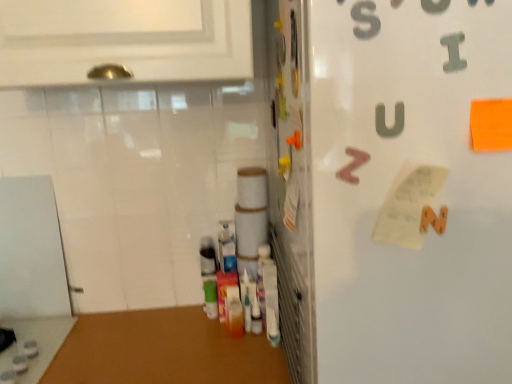
Question: In the image, is white matte refrigerator at right positioned in front of or behind metallic gray letter i at upper right, acting as the 2th alphabet starting from the back?

Choices:
 (A) behind
 (B) front

Answer: (B)

Question: In terms of height, does white matte refrigerator at right look taller or shorter compared to metallic gray letter i at upper right, the first alphabet in the top-to-bottom sequence?

Choices:
 (A) short
 (B) tall

Answer: (B)

Question: Estimate the real-world distances between objects in this image. Which object is closer to the metallic gray letter i at upper right, the first alphabet in the top-to-bottom sequence?

Choices:
 (A) white paper at center-right
 (B) white matte refrigerator at right
 (C) metallic silver door at center
 (D) brown matte letter z at upper right, the first alphabet viewed from the left

Answer: (D)

Question: Which of these objects is positioned farthest from the white matte refrigerator at right?

Choices:
 (A) white paper at center-right
 (B) metallic gray letter i at upper right, marked as the first alphabet in a right-to-left arrangement
 (C) metallic silver door at center
 (D) brown matte letter z at upper right, positioned as the second alphabet in right-to-left order

Answer: (B)